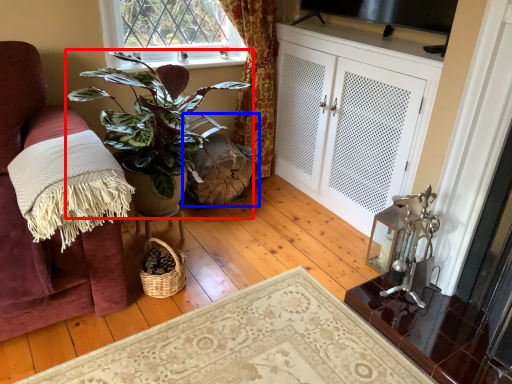
Question: Among these objects, which one is nearest to the camera, houseplant (highlighted by a red box) or swivel chair (highlighted by a blue box)?

Choices:
 (A) houseplant
 (B) swivel chair

Answer: (A)